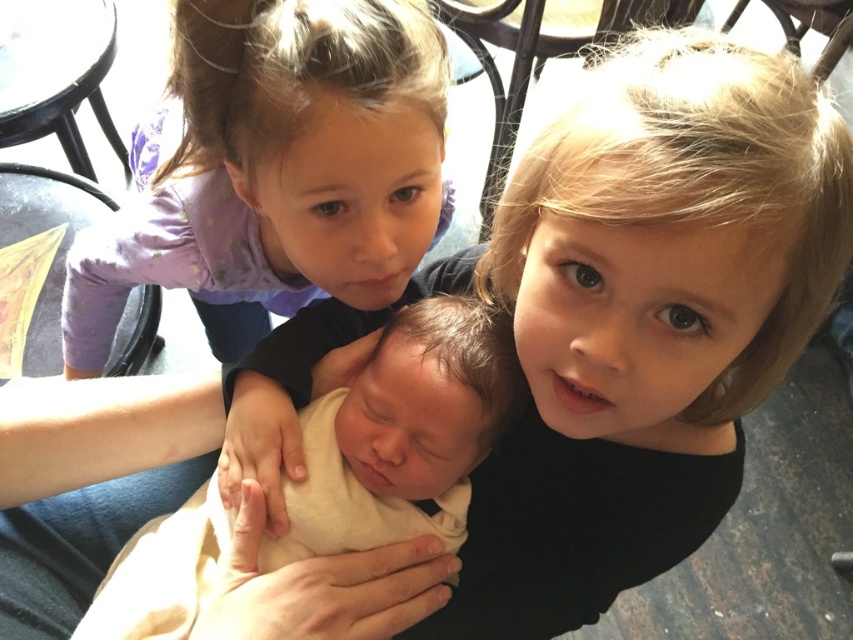
Question: Considering the relative positions of purple fabric at upper left and soft cream fabric newborn at center in the image provided, where is purple fabric at upper left located with respect to soft cream fabric newborn at center?

Choices:
 (A) above
 (B) below

Answer: (A)

Question: Is purple fabric at upper left to the left of soft cream fabric newborn at center from the viewer's perspective?

Choices:
 (A) yes
 (B) no

Answer: (A)

Question: Is purple fabric at upper left behind soft cream fabric newborn at center?

Choices:
 (A) no
 (B) yes

Answer: (B)

Question: Among these points, which one is farthest from the camera?

Choices:
 (A) (415, 234)
 (B) (393, 387)

Answer: (A)

Question: Which point is closer to the camera?

Choices:
 (A) (180, 525)
 (B) (171, 232)

Answer: (A)